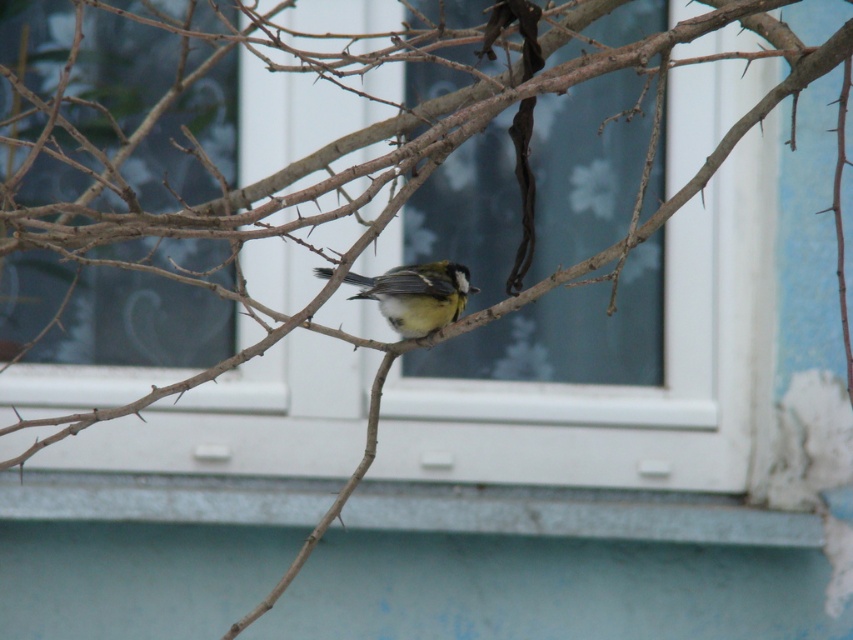
Question: Is transparent glass window at center below yellow-green feathers at center?

Choices:
 (A) no
 (B) yes

Answer: (A)

Question: Is transparent glass window at center below yellow-green feathers at center?

Choices:
 (A) yes
 (B) no

Answer: (B)

Question: Considering the real-world distances, which object is farthest from the blue painted wood at lower center?

Choices:
 (A) yellow-green feathers at center
 (B) transparent glass window at center

Answer: (A)

Question: Which object appears closest to the camera in this image?

Choices:
 (A) transparent glass window at center
 (B) yellow-green feathers at center

Answer: (B)

Question: Which of these objects is positioned farthest from the transparent glass window at center?

Choices:
 (A) yellow-green feathers at center
 (B) blue painted wood at lower center

Answer: (A)

Question: Can you confirm if blue painted wood at lower center is positioned below yellow-green feathers at center?

Choices:
 (A) no
 (B) yes

Answer: (B)